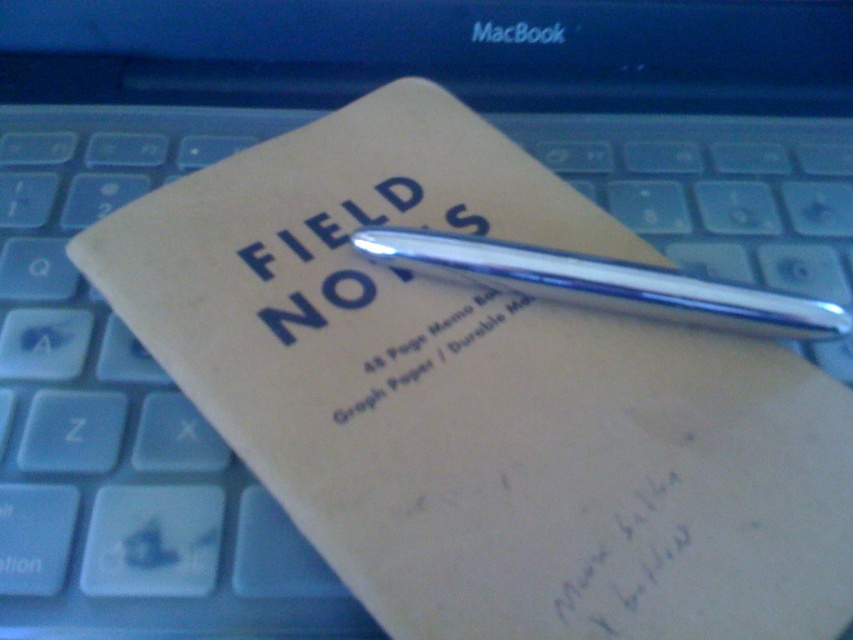
You are trying to write a note on the laptop keyboard but notice the chrome metallic pen at center and the matte black text at center. Which object is blocking your view of the text?

The chrome metallic pen at center is positioned over the matte black text at center, so it is blocking the view of the text.

Consider the image. You are trying to write a note on the white paper at center using the pen. The matte black text at center is in the way. Can you move the text to make space?

The matte black text at center is not as tall as white paper at center, so you can move the text upwards or downwards to make space on the white paper at center.

You are trying to write a note using the silver metallic pen at center and the white paper at center. However, the pen is too big to fit on the paper. Is this possible? Explain why based on the scene.

The silver metallic pen at center is larger in size than white paper at center, so it is possible that the pen is too big to fit on the paper.